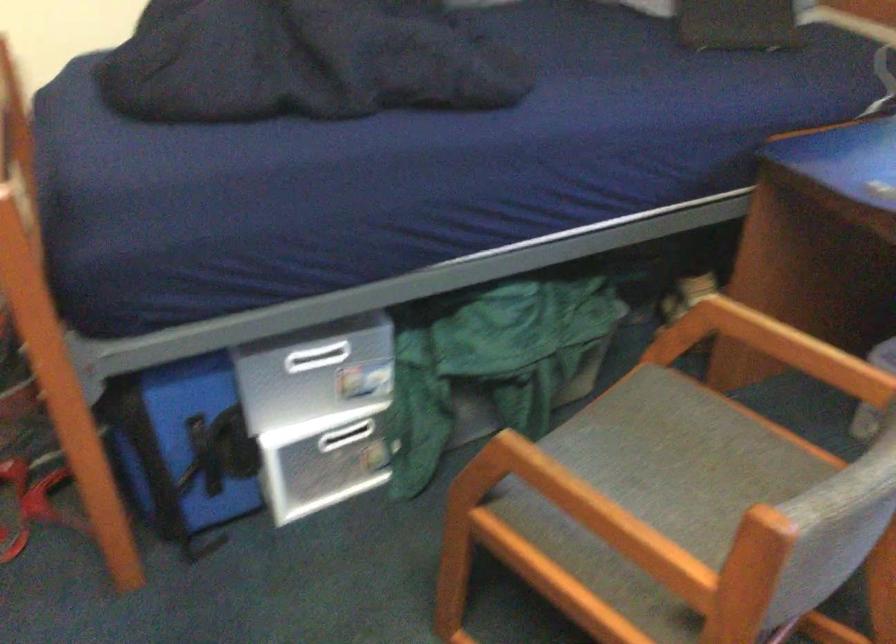
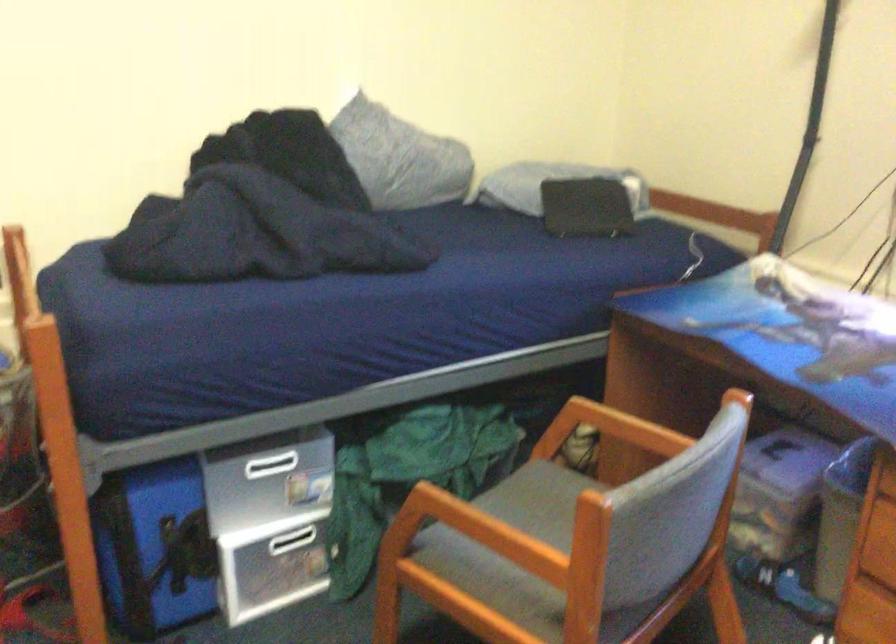
Question: How did the camera likely rotate?

Choices:
 (A) Left
 (B) Right
 (C) Up
 (D) Down

Answer: (C)